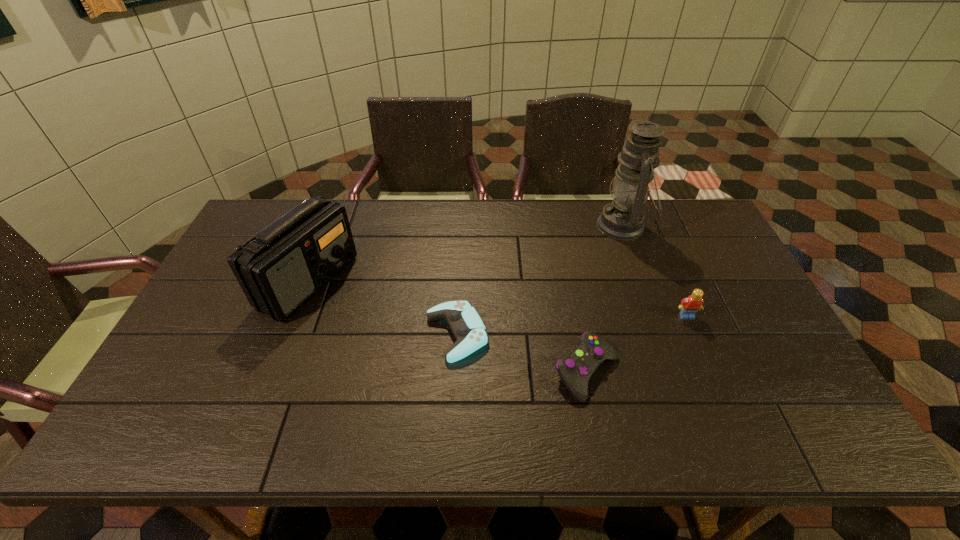
Locate an element on the screen. object that can be found as the second closest to the third shortest object is located at coordinates (623, 219).

This screenshot has width=960, height=540. In order to click on vacant space that satisfies the following two spatial constraints: 1. on the front panel of the radio receiver; 2. on the right side of the taller control in this screenshot , I will do `click(274, 372)`.

Locate an element on the screen. Image resolution: width=960 pixels, height=540 pixels. free region that satisfies the following two spatial constraints: 1. on the front panel of the radio receiver; 2. on the left side of the left control is located at coordinates (288, 334).

You are a GUI agent. You are given a task and a screenshot of the screen. Output one action in this format:
    pyautogui.click(x=<x>, y=<y>)
    Task: Click on the free space that satisfies the following two spatial constraints: 1. on the front panel of the second tallest object; 2. on the right side of the second shortest object
    
    Given the screenshot: What is the action you would take?
    click(x=274, y=372)

I want to click on vacant space that satisfies the following two spatial constraints: 1. on the front panel of the taller control; 2. on the right side of the leftmost object, so (274, 372).